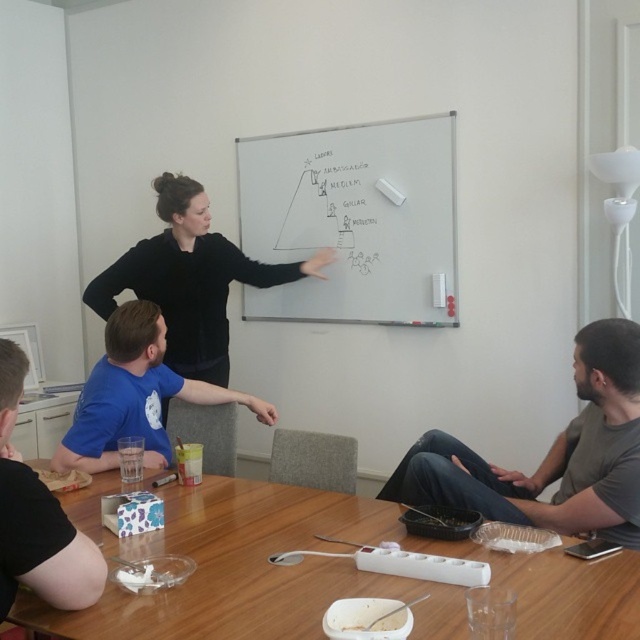
Looking at this image, you are organizing a small event and need to place a large rectangular banner that requires a surface wider than the whiteboard at upper center. Can the wooden table at lower center accommodate this banner?

The wooden table at lower center might be wider than the whiteboard at upper center, so it could potentially accommodate the banner if the banner is narrower than the table.

Based on the photo, you are standing at the entrance of the meeting room and see two points on the table. The first point is labeled as point (198, 545) and the second is point (164, 205). If you want to reach the point that is closer to you, which one should you head towards?

Point (198, 545) is in front of point (164, 205), so you should head towards point (198, 545) as it is closer to you.